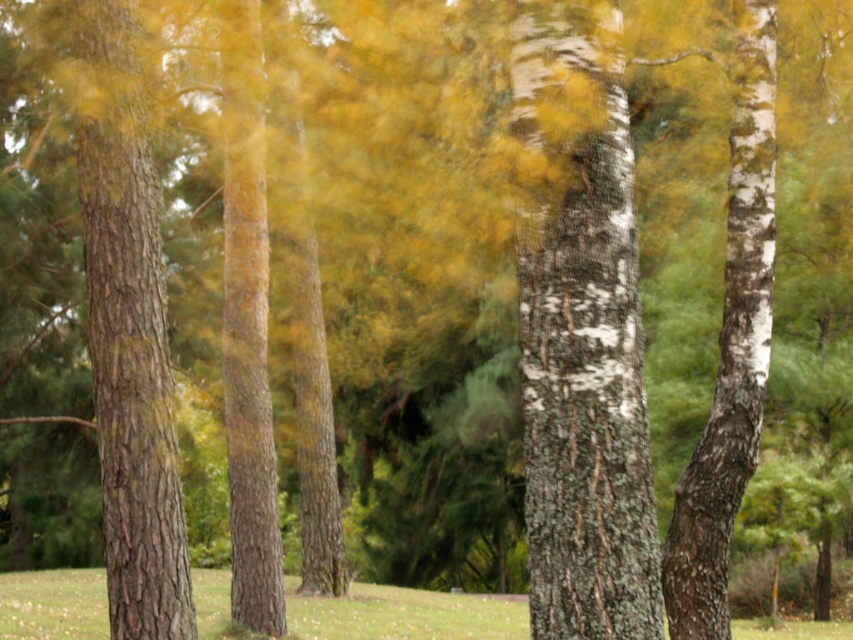
You are an arborist assessing the trees in the scene. Which tree trunk, the brown rough bark tree trunk at left or the white bark tree trunk at right, is taller?

The brown rough bark tree trunk at left is taller than the white bark tree trunk at right.

You are a hiker trying to identify the tallest tree among the white bark tree trunks in the scene. Which one between the white bark tree trunk at center and the white bark tree trunk at right is taller?

The white bark tree trunk at center is taller than the white bark tree trunk at right.

You are an artist sketching the trees in the scene. You want to draw the brown rough bark tree trunk at left and the white bark tree trunk at right. Which tree trunk should you sketch first if you want to follow the natural left to right progression of the scene?

The brown rough bark tree trunk at left should be sketched first since it is positioned on the left side of the white bark tree trunk at right, following the left to right progression.